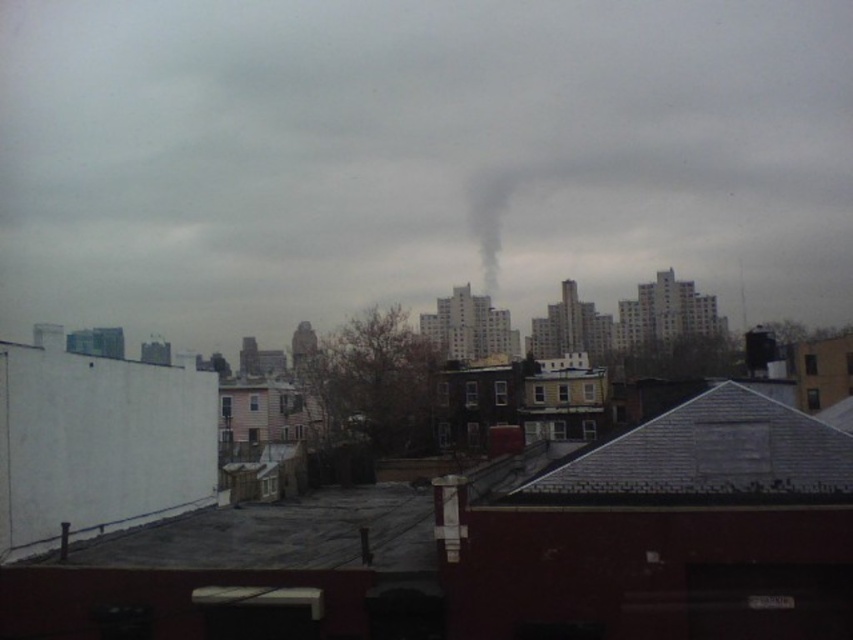
You are a city planner analyzing the urban scene. You notice two smoke sources emitting smoke at upper center and black smoke at center. Which smoke plume is wider?

The smoke at upper center is wider than the black smoke at center.

You are standing on the rooftop of the red brick building in the foreground. You notice a smoke at upper center. Based on its position, can you estimate the coordinates of the smoke relative to your current position?

The smoke at upper center is located at coordinates point (415, 156) relative to your position on the rooftop of the red brick building.

From the picture: You are a firefighter assessing the scene from a distance. You notice two smoke plumes in the image. Which smoke plume, the smoke at upper center or the black smoke at center, is located higher in the image?

The smoke at upper center is located higher in the image than the black smoke at center.